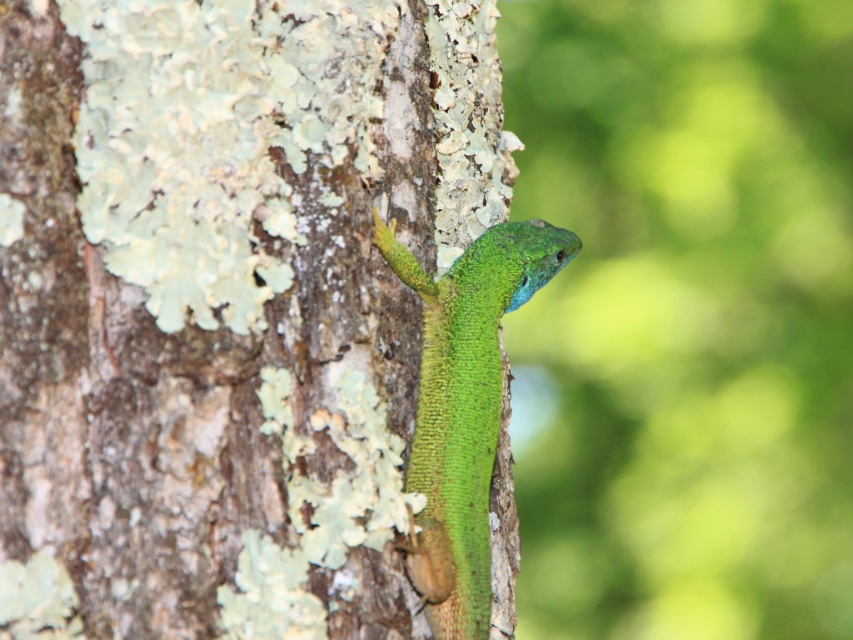
You are a photographer using a camera with a focal length of 50mm. You want to capture a closeup of the green rough bark tree at center while maintaining the blurred background. If your camera is set to a depth of field of 1 meter, will the background remain blurred?

The distance between the green rough bark tree at center and the camera is 1.12 meters. Since the depth of field is set to 1 meter, the background will remain blurred as the subject is slightly beyond the depth of field range, but the blur effect is maintained.

In the scene shown: You are an artist trying to sketch the lizard in the image. You need to determine which of the two points, point (x=294, y=515) or point (x=474, y=275), should be drawn first to establish depth. Which point should you start with?

You should start with point (x=294, y=515) because it is closer to the viewer than point (x=474, y=275), allowing you to build the depth by starting with foreground elements.

You are a photographer trying to capture the green lizard on the tree. You notice a point marked at coordinates (224, 304). Based on the scene description, what does this point indicate?

The point at (224, 304) marks the green rough bark tree at center.